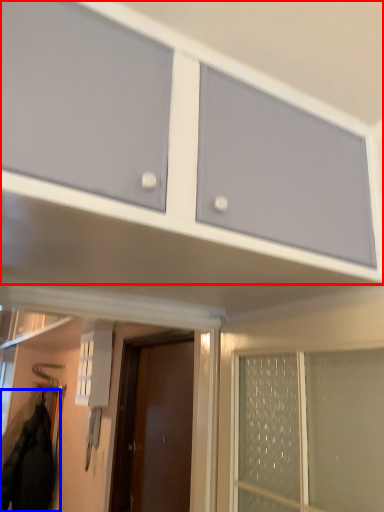
Question: Which of the following is the farthest to the observer, cabinetry (highlighted by a red box) or jacket (highlighted by a blue box)?

Choices:
 (A) cabinetry
 (B) jacket

Answer: (B)